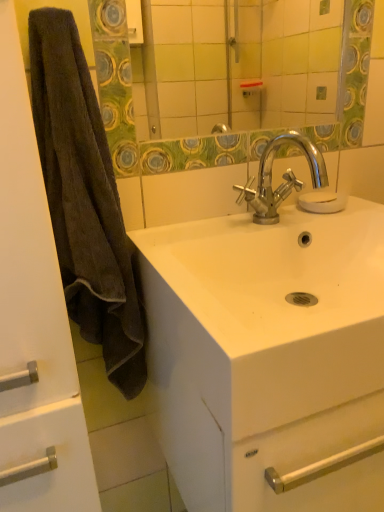
Describe the element at coordinates (85, 201) in the screenshot. The height and width of the screenshot is (512, 384). I see `brown fuzzy towel at left` at that location.

What do you see at coordinates (240, 64) in the screenshot? The width and height of the screenshot is (384, 512). I see `green textured mirror at upper center` at bounding box center [240, 64].

At what (x,y) coordinates should I click in order to perform the action: click on brown fuzzy towel at left. Please return your answer as a coordinate pair (x, y). This screenshot has width=384, height=512. Looking at the image, I should click on click(x=85, y=201).

How far apart are brown fuzzy towel at left and transparent glass soap at center?

brown fuzzy towel at left and transparent glass soap at center are 20.36 inches apart.

Considering the relative sizes of brown fuzzy towel at left and transparent glass soap at center in the image provided, is brown fuzzy towel at left wider than transparent glass soap at center?

Yes.

Is brown fuzzy towel at left smaller than transparent glass soap at center?

Actually, brown fuzzy towel at left might be larger than transparent glass soap at center.

Is point (108, 178) positioned before point (311, 197)?

Yes, it is in front of point (311, 197).

How many degrees apart are the facing directions of white glossy sink at center and green textured mirror at upper center?

0.496 degrees separate the facing orientations of white glossy sink at center and green textured mirror at upper center.

Which object is thinner, white glossy sink at center or green textured mirror at upper center?

Thinner between the two is green textured mirror at upper center.

Would you say white glossy sink at center is inside or outside green textured mirror at upper center?

white glossy sink at center cannot be found inside green textured mirror at upper center.

From the image's perspective, does green textured mirror at upper center appear lower than brown fuzzy towel at left?

Actually, green textured mirror at upper center appears above brown fuzzy towel at left in the image.

Does green textured mirror at upper center have a larger size compared to brown fuzzy towel at left?

Actually, green textured mirror at upper center might be smaller than brown fuzzy towel at left.

Does green textured mirror at upper center have a lesser height compared to brown fuzzy towel at left?

Yes, green textured mirror at upper center is shorter than brown fuzzy towel at left.

How different are the orientations of green textured mirror at upper center and brown fuzzy towel at left in degrees?

The angular difference between green textured mirror at upper center and brown fuzzy towel at left is 0.496 degrees.

Could you tell me if transparent glass soap at center is turned towards brown fuzzy towel at left?

No, transparent glass soap at center is not aimed at brown fuzzy towel at left.

Considering the relative sizes of transparent glass soap at center and brown fuzzy towel at left in the image provided, is transparent glass soap at center taller than brown fuzzy towel at left?

No.

From the image's perspective, is transparent glass soap at center on brown fuzzy towel at left?

Indeed, from the image's perspective, transparent glass soap at center is shown above brown fuzzy towel at left.

The height and width of the screenshot is (512, 384). In order to click on bathroom cabinet below the transparent glass soap at center (from a real-world perspective) in this screenshot , I will do `click(34, 319)`.

Does transparent glass soap at center turn towards white glossy sink at center?

No, transparent glass soap at center is not oriented towards white glossy sink at center.

Based on their sizes in the image, would you say transparent glass soap at center is bigger or smaller than white glossy sink at center?

transparent glass soap at center is smaller than white glossy sink at center.

From the picture: Does transparent glass soap at center have a greater width compared to white glossy sink at center?

In fact, transparent glass soap at center might be narrower than white glossy sink at center.

From a real-world perspective, who is located higher, transparent glass soap at center or white glossy sink at center?

transparent glass soap at center is physically above.

From a real-world perspective, is transparent glass soap at center below chrome metallic faucet at center?

Yes, from a real-world perspective, transparent glass soap at center is beneath chrome metallic faucet at center.

Can you see transparent glass soap at center touching chrome metallic faucet at center?

Yes, transparent glass soap at center is right next to chrome metallic faucet at center and making contact.

Can you confirm if transparent glass soap at center is wider than chrome metallic faucet at center?

In fact, transparent glass soap at center might be narrower than chrome metallic faucet at center.

Locate an element on the screen. tap that is on the left side of transparent glass soap at center is located at coordinates (283, 178).

Does brown fuzzy towel at left have a greater height compared to brown fuzzy towel at left?

Incorrect, the height of brown fuzzy towel at left is not larger of that of brown fuzzy towel at left.

Who is smaller, brown fuzzy towel at left or brown fuzzy towel at left?

With smaller size is brown fuzzy towel at left.

Which object is further away from the camera, brown fuzzy towel at left or brown fuzzy towel at left?

Positioned behind is brown fuzzy towel at left.

I want to click on bathroom cabinet below the brown fuzzy towel at left (from the image's perspective), so click(x=34, y=319).

This screenshot has height=512, width=384. Find the location of `bath towel located in front of the transparent glass soap at center`. bath towel located in front of the transparent glass soap at center is located at coordinates (85, 201).

Where is `sink that appears below the green textured mirror at upper center (from the image's perspective)`? sink that appears below the green textured mirror at upper center (from the image's perspective) is located at coordinates (270, 352).

Looking at the image, which one is located further to transparent glass soap at center, white glossy sink at center or brown fuzzy towel at left?

The object further to transparent glass soap at center is brown fuzzy towel at left.

Which object lies nearer to the anchor point brown fuzzy towel at left, transparent glass soap at center or green textured mirror at upper center?

transparent glass soap at center is closer to brown fuzzy towel at left.

From the image, which object appears to be nearer to brown fuzzy towel at left, green textured mirror at upper center or brown fuzzy towel at left?

brown fuzzy towel at left.

From the image, which object appears to be nearer to brown fuzzy towel at left, white glossy sink at center or brown fuzzy towel at left?

brown fuzzy towel at left.

Based on their spatial positions, is brown fuzzy towel at left or white glossy sink at center closer to green textured mirror at upper center?

Based on the image, white glossy sink at center appears to be nearer to green textured mirror at upper center.

From the image, which object appears to be nearer to chrome metallic faucet at center, brown fuzzy towel at left or green textured mirror at upper center?

The object closer to chrome metallic faucet at center is brown fuzzy towel at left.

Based on their spatial positions, is chrome metallic faucet at center or brown fuzzy towel at left closer to green textured mirror at upper center?

chrome metallic faucet at center is positioned closer to the anchor green textured mirror at upper center.

Which object lies further to the anchor point transparent glass soap at center, green textured mirror at upper center or white glossy sink at center?

Among the two, green textured mirror at upper center is located further to transparent glass soap at center.

Image resolution: width=384 pixels, height=512 pixels. I want to click on mirror between brown fuzzy towel at left and chrome metallic faucet at center, so click(240, 64).

What are the coordinates of `sink between brown fuzzy towel at left and transparent glass soap at center from front to back` in the screenshot? It's located at (270, 352).

Identify the location of mirror located between brown fuzzy towel at left and transparent glass soap at center in the depth direction. The height and width of the screenshot is (512, 384). (240, 64).

At what (x,y) coordinates should I click in order to perform the action: click on tap between brown fuzzy towel at left and transparent glass soap at center in the front-back direction. Please return your answer as a coordinate pair (x, y). The image size is (384, 512). Looking at the image, I should click on (283, 178).